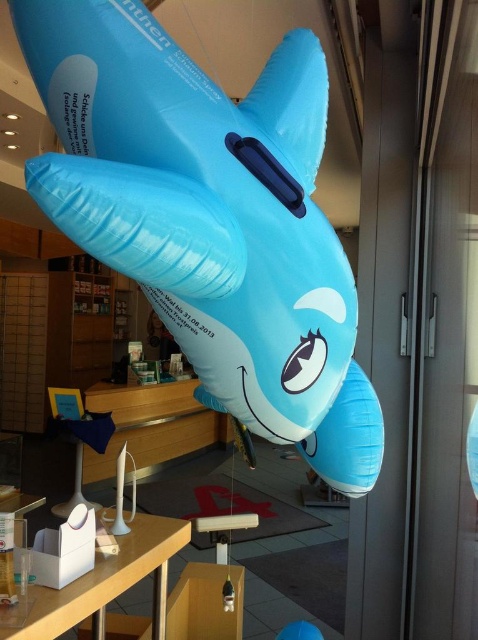
Question: Among these points, which one is farthest from the camera?

Choices:
 (A) (307, 621)
 (B) (377, 460)
 (C) (45, 611)
 (D) (288, 45)

Answer: (A)

Question: Can you confirm if blue rubber dolphin at center is positioned above blue inflatable shark at center?

Choices:
 (A) yes
 (B) no

Answer: (A)

Question: Based on their relative distances, which object is farther from the blue rubber dolphin at center?

Choices:
 (A) white plastic table at lower center
 (B) blue inflatable dolphin at center

Answer: (A)

Question: Among these points, which one is farthest from the camera?

Choices:
 (A) (143, 556)
 (B) (332, 468)
 (C) (191, 326)
 (D) (322, 637)

Answer: (D)

Question: Is white plastic table at lower center below blue inflatable shark at center?

Choices:
 (A) yes
 (B) no

Answer: (B)

Question: Is white plastic table at lower center further to the viewer compared to blue inflatable shark at center?

Choices:
 (A) no
 (B) yes

Answer: (A)